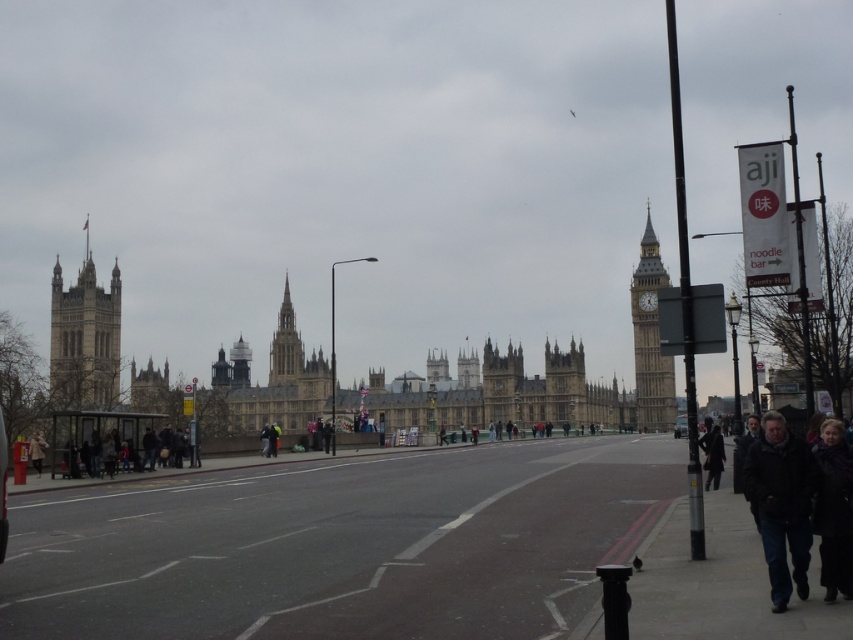
You are a delivery drone that needs to fly from the stone tower at left to the dark fur coat at lower right. Given that your maximum flight distance is 120 meters, will you be able to complete the delivery without recharging?

→ The stone tower at left is 122.81 meters away from the dark fur coat at lower right. Since the distance exceeds the drone s maximum flight distance of 120 meters, the drone cannot complete the delivery without recharging.

You are a tourist standing on the bridge and want to take a photo of the stone tower at left and the dark fur coat at lower right. Which object should you zoom in more on to ensure both are clearly visible in the photo?

The stone tower at left is wider than the dark fur coat at lower right, so you should zoom in more on the stone tower at left to ensure both are clearly visible in the photo.